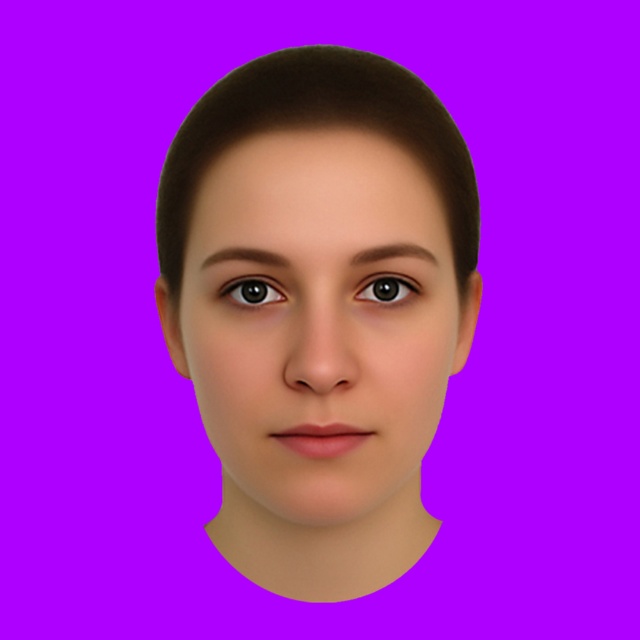
Looking at the headshot against the purple background, you notice the smooth skin face at center and the brown glossy eye at upper left. Which object has a greater width?

The smooth skin face at center has a greater width than the brown glossy eye at upper left.

You are a makeup artist preparing to apply foundation to a client. You have a brush that is 3 centimeters long. If you are holding the brush at the handle and want to reach from the smooth skin face at center to the brown glossy eye at upper left, will the brush be long enough?

The smooth skin face at center is 5.31 centimeters away from the brown glossy eye at upper left. Since the brush is only 3 centimeters long, it is not long enough to reach from the smooth skin face at center to the brown glossy eye at upper left.

You are an artist trying to paint the subject of this headshot. You need to decide the order to paint the brown matte hair at center and the brown glossy eye at upper left. Which should you paint first based on their positions?

The brown matte hair at center is located above the brown glossy eye at upper left, so you should paint the brown glossy eye at upper left first before moving to the hair above it.